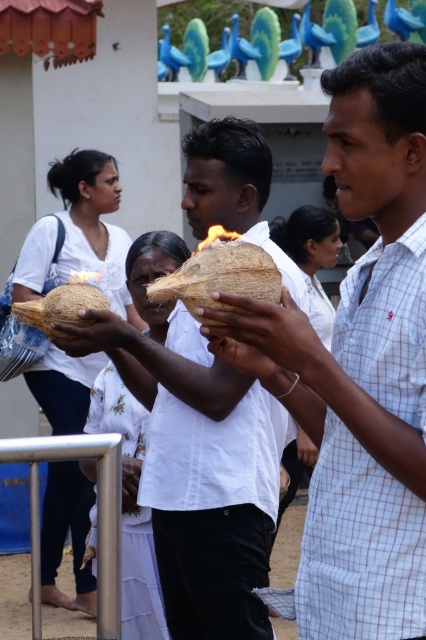
You are an event planner organizing a fire ceremony. You need to choose between the white matte coconut at center and the coconut shell at center to hold a flame. Which one is better suited based on their height?

The white matte coconut at center is much taller than the coconut shell at center, making it better suited to hold the flame as it provides more space and stability.

In the scene shown: You are an observer at the ceremony and notice the white matte coconut at center and the coconut shell at center. Which object is positioned higher in the image?

The white matte coconut at center is positioned higher than the coconut shell at center according to the description.